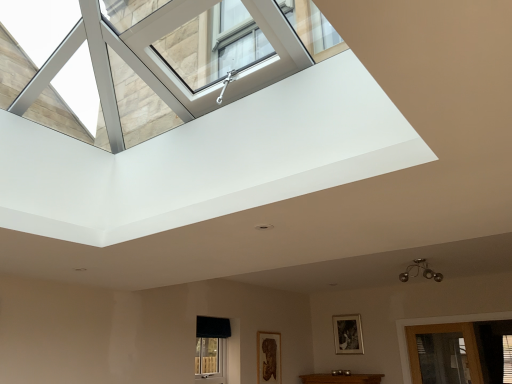
Question: Considering the positions of wooden picture frame at center, arranged as the second picture frame when viewed from the left, and transparent glass door at lower right in the image, is wooden picture frame at center, arranged as the second picture frame when viewed from the left, bigger or smaller than transparent glass door at lower right?

Choices:
 (A) small
 (B) big

Answer: (A)

Question: Relative to transparent glass door at lower right, is wooden picture frame at center, acting as the 1th picture frame starting from the right, in front or behind?

Choices:
 (A) front
 (B) behind

Answer: (B)

Question: Which object is positioned closest to the transparent glass door at lower right?

Choices:
 (A) black fabric window at lower center
 (B) wooden picture frame at center, arranged as the second picture frame when viewed from the left
 (C) wooden carved frame at lower center, positioned as the second picture frame in right-to-left order

Answer: (B)

Question: Which object is positioned closest to the wooden carved frame at lower center, positioned as the second picture frame in right-to-left order?

Choices:
 (A) black fabric window at lower center
 (B) transparent glass door at lower right
 (C) wooden picture frame at center, acting as the 1th picture frame starting from the right

Answer: (A)